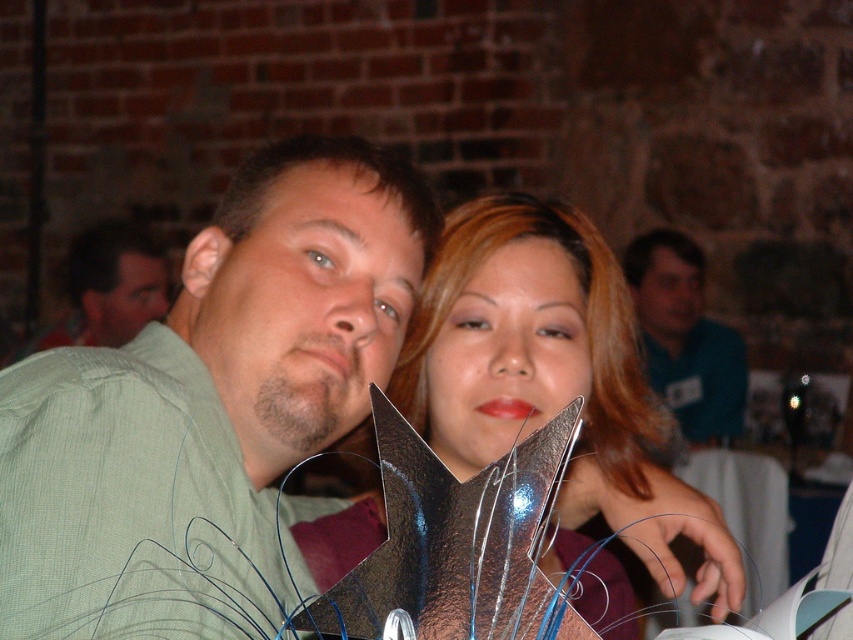
You are standing at the center of the scene and want to hand a gift to the blue shirt at upper right and the matte green shirt at center. Which person is farther from you?

The blue shirt at upper right is 9.71 feet away from matte green shirt at center, so the blue shirt at upper right is farther from you.

You are taking a photo of two people at a social gathering. You see a blue shirt at upper right and a matte green shirt at center. Which shirt is closer to the camera?

The blue shirt at upper right is closer to the viewer than the matte green shirt at center, so the blue shirt at upper right is closer to the camera.

Based on the photo, you are trying to determine the position of the blue shirt at upper right in the image. What are its coordinates?

The blue shirt at upper right is located at coordinates (685, 339).